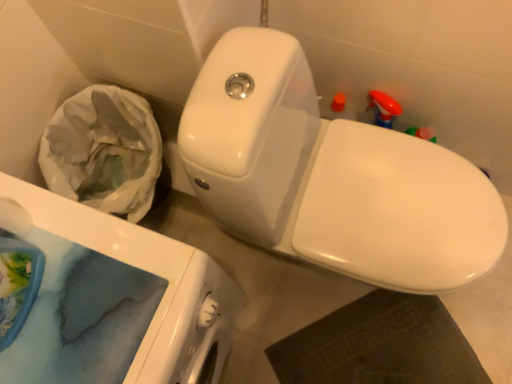
Describe the element at coordinates (14, 218) in the screenshot. I see `white matte toilet paper at lower left` at that location.

The height and width of the screenshot is (384, 512). What do you see at coordinates (112, 300) in the screenshot?
I see `white glossy porcelain at upper right` at bounding box center [112, 300].

Identify the location of white glossy toilet at center. (330, 176).

You are a GUI agent. You are given a task and a screenshot of the screen. Output one action in this format:
    pyautogui.click(x=<x>, y=<y>)
    Task: Click on the white matte toilet paper at lower left
    The image size is (512, 384).
    Given the screenshot: What is the action you would take?
    pyautogui.click(x=14, y=218)

What's the angular difference between white glossy toilet at center and white matte toilet paper at lower left's facing directions?

white glossy toilet at center and white matte toilet paper at lower left are facing 0.997 degrees away from each other.

How much distance is there between white glossy toilet at center and white matte toilet paper at lower left?

21.71 inches.

Is white glossy toilet at center smaller than white matte toilet paper at lower left?

Actually, white glossy toilet at center might be larger than white matte toilet paper at lower left.

Does point (498, 249) come farther from viewer compared to point (0, 201)?

Yes, it is behind point (0, 201).

Based on their sizes in the image, would you say white glossy toilet at center is bigger or smaller than white glossy porcelain at upper right?

white glossy toilet at center is smaller than white glossy porcelain at upper right.

Is white glossy toilet at center in front of or behind white glossy porcelain at upper right in the image?

In the image, white glossy toilet at center appears in front of white glossy porcelain at upper right.

In the scene shown: Who is smaller, white glossy porcelain at upper right or white glossy toilet at center?

Smaller between the two is white glossy toilet at center.

Can you tell me how much white glossy porcelain at upper right and white glossy toilet at center differ in facing direction?

white glossy porcelain at upper right and white glossy toilet at center are facing 0.00035 degrees away from each other.

Can you confirm if white glossy porcelain at upper right is shorter than white glossy toilet at center?

No, white glossy porcelain at upper right is not shorter than white glossy toilet at center.

Is white glossy porcelain at upper right positioned with its back to white glossy toilet at center?

That's not correct — white glossy porcelain at upper right is not looking away from white glossy toilet at center.

Is white matte toilet paper at lower left wider or thinner than white glossy porcelain at upper right?

Considering their sizes, white matte toilet paper at lower left looks slimmer than white glossy porcelain at upper right.

Which is closer to the camera, (19, 227) or (81, 226)?

Positioned in front is point (19, 227).

This screenshot has width=512, height=384. In the image, there is a white matte toilet paper at lower left. Find the location of `porcelain below it (from the image's perspective)`. porcelain below it (from the image's perspective) is located at coordinates (112, 300).

Considering the relative sizes of white matte toilet paper at lower left and white glossy porcelain at upper right in the image provided, is white matte toilet paper at lower left smaller than white glossy porcelain at upper right?

Yes.

From a real-world perspective, between white glossy porcelain at upper right and white matte toilet paper at lower left, who is vertically higher?

white matte toilet paper at lower left.

Considering the sizes of objects white glossy porcelain at upper right and white matte toilet paper at lower left in the image provided, who is bigger, white glossy porcelain at upper right or white matte toilet paper at lower left?

white glossy porcelain at upper right.

Between white glossy porcelain at upper right and white matte toilet paper at lower left, which one has more height?

white glossy porcelain at upper right.

From the image's perspective, relative to white matte toilet paper at lower left, is white glossy porcelain at upper right above or below?

Clearly, from the image's perspective, white glossy porcelain at upper right is below white matte toilet paper at lower left.

Considering the points (17, 209) and (237, 183), which point is behind, point (17, 209) or point (237, 183)?

The point (237, 183) is more distant.

Is white matte toilet paper at lower left at the left side of white glossy toilet at center?

Correct, you'll find white matte toilet paper at lower left to the left of white glossy toilet at center.

Which is correct: white matte toilet paper at lower left is inside white glossy toilet at center, or outside of it?

white matte toilet paper at lower left is spatially situated outside white glossy toilet at center.

Considering the relative sizes of white matte toilet paper at lower left and white glossy toilet at center in the image provided, is white matte toilet paper at lower left wider than white glossy toilet at center?

No, white matte toilet paper at lower left is not wider than white glossy toilet at center.

Identify the location of toilet on the right of white matte toilet paper at lower left. The width and height of the screenshot is (512, 384). (330, 176).

The width and height of the screenshot is (512, 384). I want to click on porcelain below the white glossy toilet at center (from the image's perspective), so click(112, 300).

Based on their spatial positions, is white glossy toilet at center or white matte toilet paper at lower left closer to white glossy porcelain at upper right?

white matte toilet paper at lower left is positioned closer to the anchor white glossy porcelain at upper right.

When comparing their distances from white glossy toilet at center, does white matte toilet paper at lower left or white glossy porcelain at upper right seem closer?

white glossy porcelain at upper right lies closer to white glossy toilet at center than the other object.

From the image, which object appears to be nearer to white matte toilet paper at lower left, white glossy porcelain at upper right or white glossy toilet at center?

The object closer to white matte toilet paper at lower left is white glossy porcelain at upper right.

Which object lies further to the anchor point white matte toilet paper at lower left, white glossy toilet at center or white glossy porcelain at upper right?

Based on the image, white glossy toilet at center appears to be further to white matte toilet paper at lower left.

From the image, which object appears to be nearer to white glossy toilet at center, white glossy porcelain at upper right or white matte toilet paper at lower left?

white glossy porcelain at upper right is closer to white glossy toilet at center.

Estimate the real-world distances between objects in this image. Which object is closer to white glossy porcelain at upper right, white matte toilet paper at lower left or white glossy toilet at center?

white matte toilet paper at lower left is positioned closer to the anchor white glossy porcelain at upper right.

I want to click on porcelain between white matte toilet paper at lower left and white glossy toilet at center in the horizontal direction, so click(x=112, y=300).